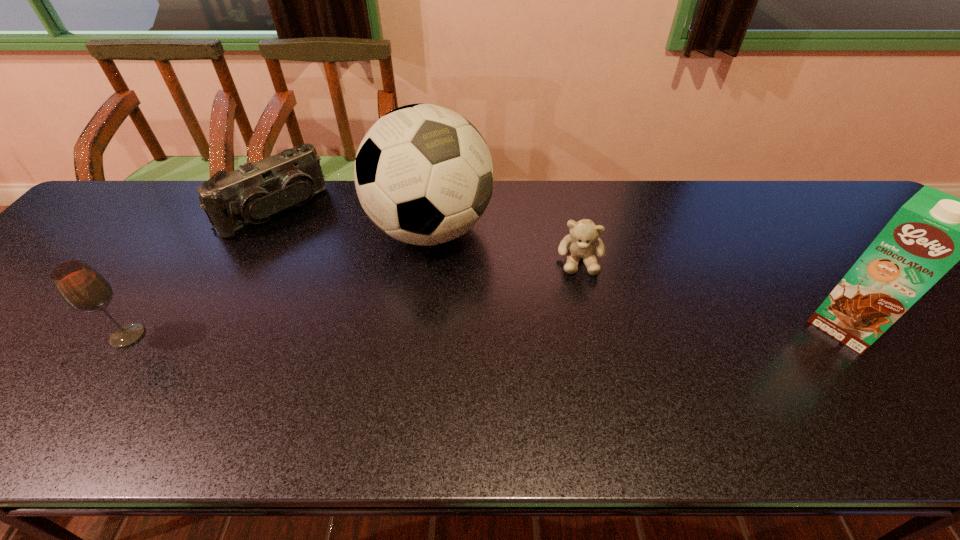
Find the location of `vacant area at the near edge`. vacant area at the near edge is located at coordinates (769, 398).

In the image, there is a desktop. Where is `vacant space at the left edge`? vacant space at the left edge is located at coordinates (52, 261).

Locate an element on the screen. Image resolution: width=960 pixels, height=540 pixels. free spot at the right edge of the desktop is located at coordinates (861, 247).

Locate an element on the screen. This screenshot has height=540, width=960. vacant space at the far right corner of the desktop is located at coordinates (840, 190).

Where is `empty location between the rightmost object and the soccer ball`? The image size is (960, 540). empty location between the rightmost object and the soccer ball is located at coordinates (637, 278).

The width and height of the screenshot is (960, 540). I want to click on free space between the carton and the teddy bear, so click(712, 293).

Find the location of a particular element. The width and height of the screenshot is (960, 540). vacant area that lies between the third shortest object and the fourth object from left to right is located at coordinates (354, 298).

I want to click on vacant region between the rightmost object and the third object from right to left, so click(637, 278).

The image size is (960, 540). Find the location of `vacant point located between the soccer ball and the camcorder`. vacant point located between the soccer ball and the camcorder is located at coordinates (352, 220).

Where is `vacant area between the rightmost object and the camcorder`? This screenshot has height=540, width=960. vacant area between the rightmost object and the camcorder is located at coordinates (560, 268).